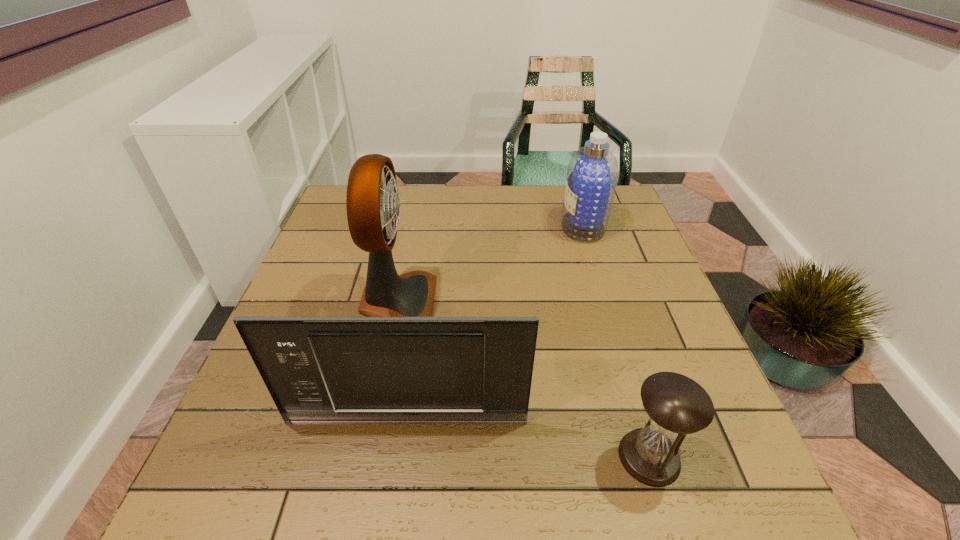
In the image, there is a desktop. Where is `vacant region at the far left corner`? The width and height of the screenshot is (960, 540). vacant region at the far left corner is located at coordinates click(343, 207).

Locate an element on the screen. This screenshot has height=540, width=960. vacant point located between the nearest object and the cleansing agent is located at coordinates (616, 341).

You are a GUI agent. You are given a task and a screenshot of the screen. Output one action in this format:
    pyautogui.click(x=<x>, y=<y>)
    Task: Click on the unoccupied area between the second nearest object and the shortest object
    
    Given the screenshot: What is the action you would take?
    pyautogui.click(x=528, y=438)

You are a GUI agent. You are given a task and a screenshot of the screen. Output one action in this format:
    pyautogui.click(x=<x>, y=<y>)
    Task: Click on the vacant area that lies between the farthest object and the hourglass
    This screenshot has width=960, height=540.
    Given the screenshot: What is the action you would take?
    pyautogui.click(x=616, y=341)

Identify the location of free space that is in between the nearest object and the cleansing agent. (616, 341).

Identify the location of free point between the farthest object and the nearest object. (616, 341).

In order to click on object that stands as the closest to the tallest object in this screenshot , I will do `click(456, 370)`.

Where is `object that is the closest to the tallest object`? The height and width of the screenshot is (540, 960). object that is the closest to the tallest object is located at coordinates (456, 370).

The image size is (960, 540). Find the location of `vacant space that satisfies the following two spatial constraints: 1. on the front panel of the hourglass; 2. on the right side of the second nearest object`. vacant space that satisfies the following two spatial constraints: 1. on the front panel of the hourglass; 2. on the right side of the second nearest object is located at coordinates (401, 457).

The height and width of the screenshot is (540, 960). In order to click on vacant space that satisfies the following two spatial constraints: 1. on the front panel of the shortest object; 2. on the left side of the third farthest object in this screenshot , I will do `click(401, 457)`.